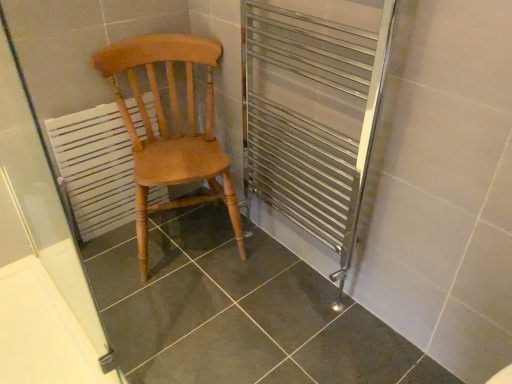
Where is `vacant space situated above white painted wood radiator at left (from a real-world perspective)`? This screenshot has height=384, width=512. vacant space situated above white painted wood radiator at left (from a real-world perspective) is located at coordinates (93, 104).